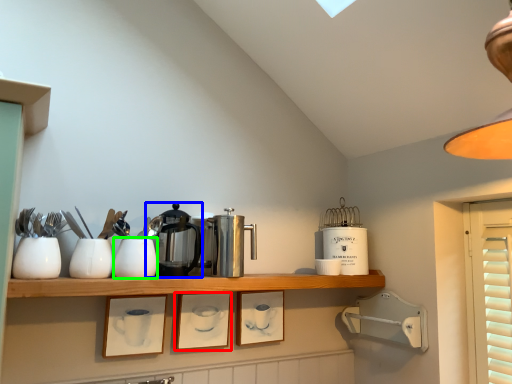
Question: Estimate the real-world distances between objects in this image. Which object is closer to picture frame (highlighted by a red box), coffeepot (highlighted by a blue box) or tableware (highlighted by a green box)?

Choices:
 (A) coffeepot
 (B) tableware

Answer: (A)